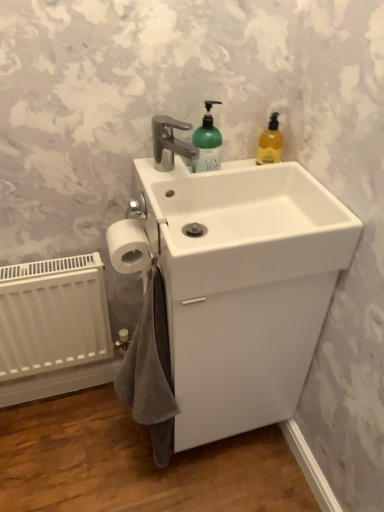
Locate an element on the screen. This screenshot has height=512, width=384. vacant area that is situated to the right of gray cotton bath towel at lower left is located at coordinates (210, 468).